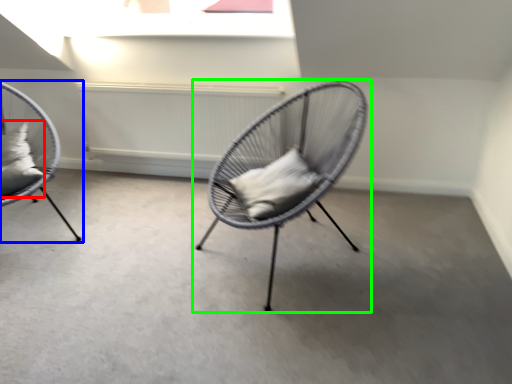
Question: Considering the real-world distances, which object is closest to pillow (highlighted by a red box)? chair (highlighted by a blue box) or chair (highlighted by a green box).

Choices:
 (A) chair
 (B) chair

Answer: (A)